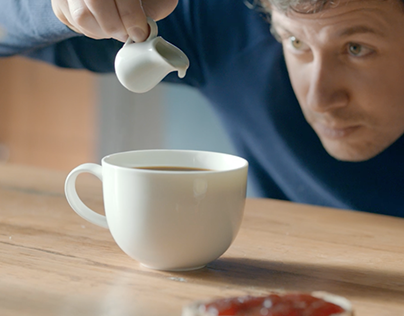
Find the location of a particular element. This screenshot has width=404, height=316. brown shadow cast by teacup is located at coordinates (301, 274).